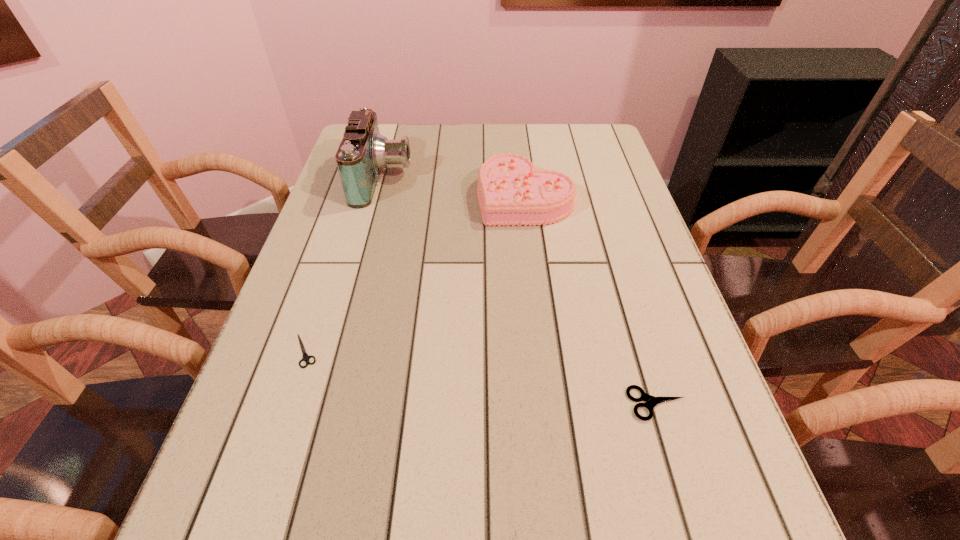
Where is `free space that satisfies the following two spatial constraints: 1. on the front side of the second shortest object; 2. on the right side of the second nearest object`? The height and width of the screenshot is (540, 960). free space that satisfies the following two spatial constraints: 1. on the front side of the second shortest object; 2. on the right side of the second nearest object is located at coordinates (288, 404).

You are a GUI agent. You are given a task and a screenshot of the screen. Output one action in this format:
    pyautogui.click(x=<x>, y=<y>)
    Task: Click on the vacant space that satisfies the following two spatial constraints: 1. on the back side of the taller shears; 2. on the front-facing side of the camcorder
    The image size is (960, 540).
    Given the screenshot: What is the action you would take?
    pyautogui.click(x=589, y=179)

You are a GUI agent. You are given a task and a screenshot of the screen. Output one action in this format:
    pyautogui.click(x=<x>, y=<y>)
    Task: Click on the vacant area in the image that satisfies the following two spatial constraints: 1. on the front-facing side of the nearest object; 2. on the right side of the tallest object
    The width and height of the screenshot is (960, 540).
    Given the screenshot: What is the action you would take?
    pyautogui.click(x=324, y=404)

Find the location of a particular element. vacant space that satisfies the following two spatial constraints: 1. on the back side of the taller shears; 2. on the front-facing side of the camcorder is located at coordinates (589, 179).